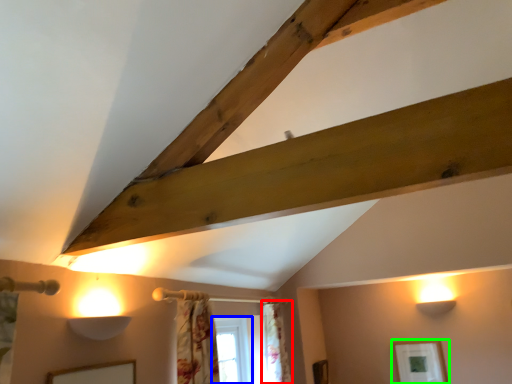
Question: Based on their relative distances, which object is farther from curtain (highlighted by a red box)? Choose from window (highlighted by a blue box) and picture frame (highlighted by a green box).

Choices:
 (A) window
 (B) picture frame

Answer: (B)